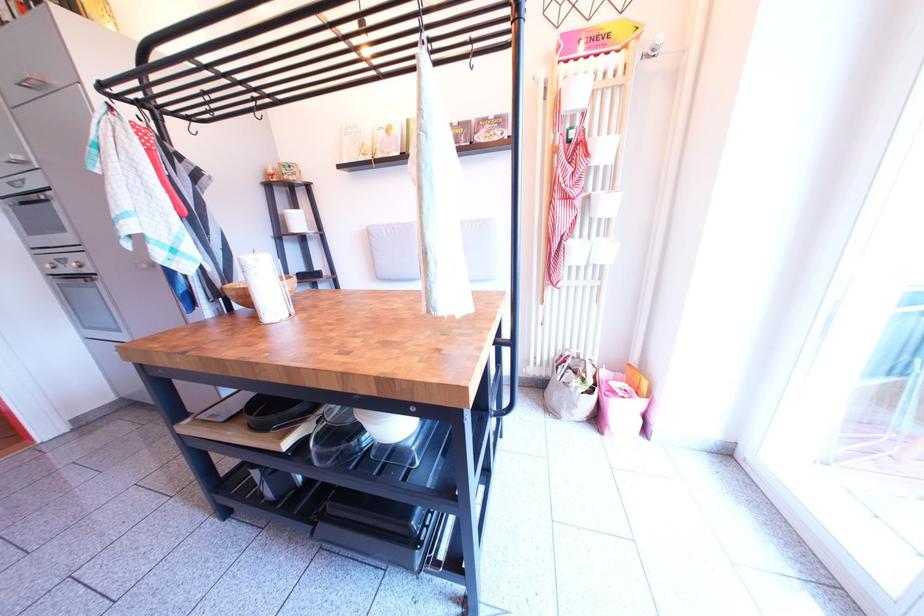
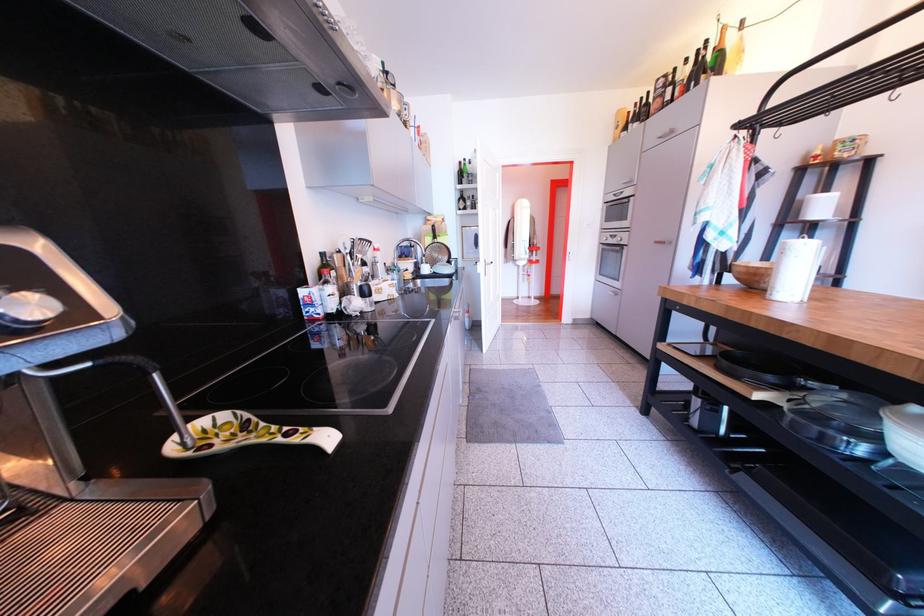
Locate, in the second image, the point that corresponds to [186,121] in the first image.

(782, 132)